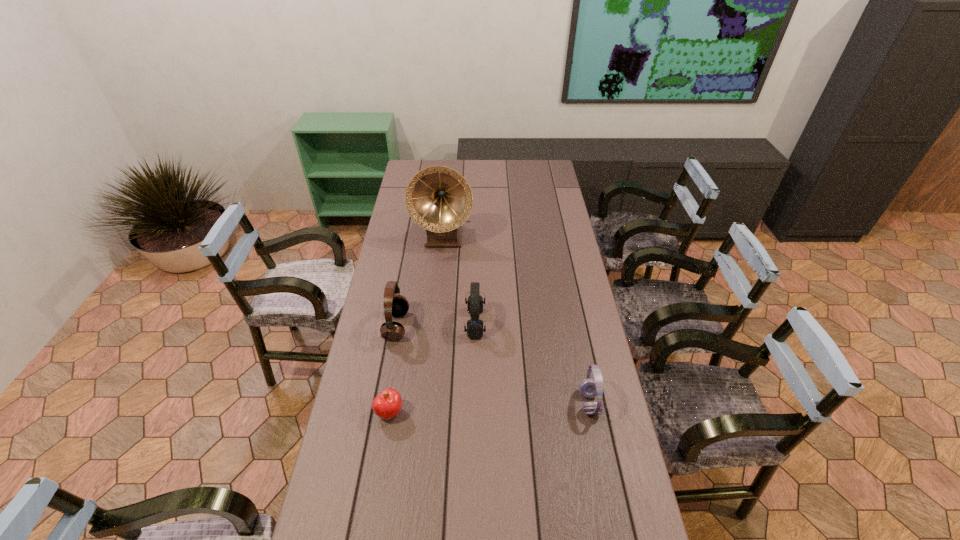
Where is `vacant space situated 0.300m on the headband and ear cups of the nearest headset`? vacant space situated 0.300m on the headband and ear cups of the nearest headset is located at coordinates (479, 403).

In order to click on free space located 0.090m on the headband and ear cups of the nearest headset in this screenshot , I will do tap(549, 403).

This screenshot has height=540, width=960. What are the coordinates of `vacant space located 0.300m on the headband and ear cups of the nearest headset` in the screenshot? It's located at (479, 403).

This screenshot has height=540, width=960. I want to click on free space located 0.190m on the right of the shortest object, so click(x=468, y=413).

This screenshot has width=960, height=540. What are the coordinates of `phonograph record positioned at the left edge` in the screenshot? It's located at (439, 199).

Where is `headset that is positioned at the left edge`? This screenshot has height=540, width=960. headset that is positioned at the left edge is located at coordinates (397, 305).

At what (x,y) coordinates should I click in order to perform the action: click on apple present at the left edge. Please return your answer as a coordinate pair (x, y). Image resolution: width=960 pixels, height=540 pixels. Looking at the image, I should click on (387, 404).

At what (x,y) coordinates should I click in order to perform the action: click on object present at the right edge. Please return your answer as a coordinate pair (x, y). This screenshot has height=540, width=960. Looking at the image, I should click on (589, 388).

Where is `vacant area at the far edge`? The width and height of the screenshot is (960, 540). vacant area at the far edge is located at coordinates (443, 159).

In the image, there is a desktop. At what (x,y) coordinates should I click in order to perform the action: click on free space at the left edge. Please return your answer as a coordinate pair (x, y). The height and width of the screenshot is (540, 960). Looking at the image, I should click on (415, 274).